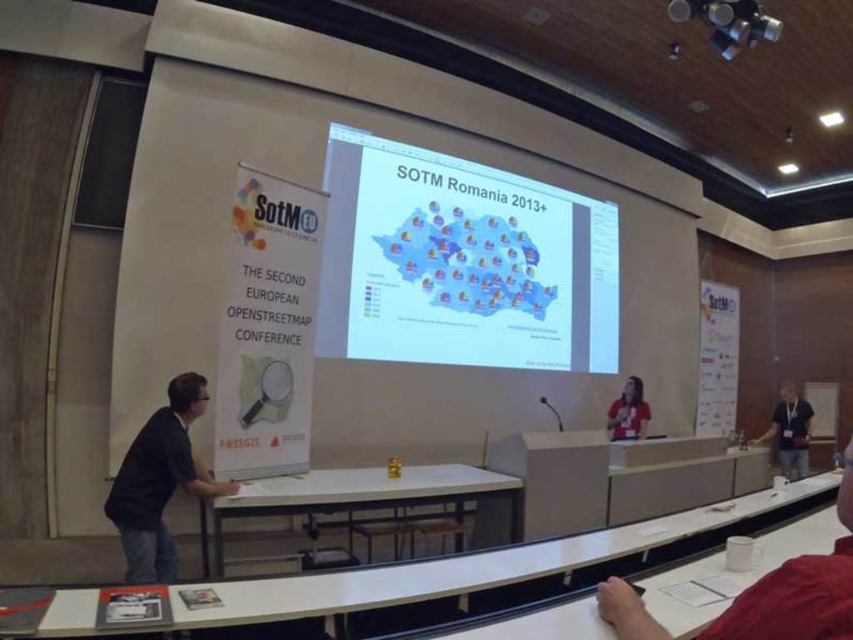
Does white matte map at center have a greater height compared to white glossy table at lower center?

Yes, white matte map at center is taller than white glossy table at lower center.

Is point (445, 164) positioned before point (90, 628)?

No, (445, 164) is further to viewer.

Where is `white matte map at center`? This screenshot has width=853, height=640. white matte map at center is located at coordinates (462, 262).

Who is lower down, black shirt at left or matte red shirt at center?

matte red shirt at center is lower down.

Which is behind, point (172, 433) or point (608, 428)?

Positioned behind is point (608, 428).

Image resolution: width=853 pixels, height=640 pixels. What are the coordinates of `black shirt at left` in the screenshot? It's located at (160, 481).

Is white glossy table at lower center to the left of black shirt at left from the viewer's perspective?

No, white glossy table at lower center is not to the left of black shirt at left.

Who is more distant from viewer, [467,556] or [143,477]?

The point [143,477] is behind.

Describe the element at coordinates (473, 564) in the screenshot. I see `white glossy table at lower center` at that location.

Locate an element on the screen. white glossy table at lower center is located at coordinates (473, 564).